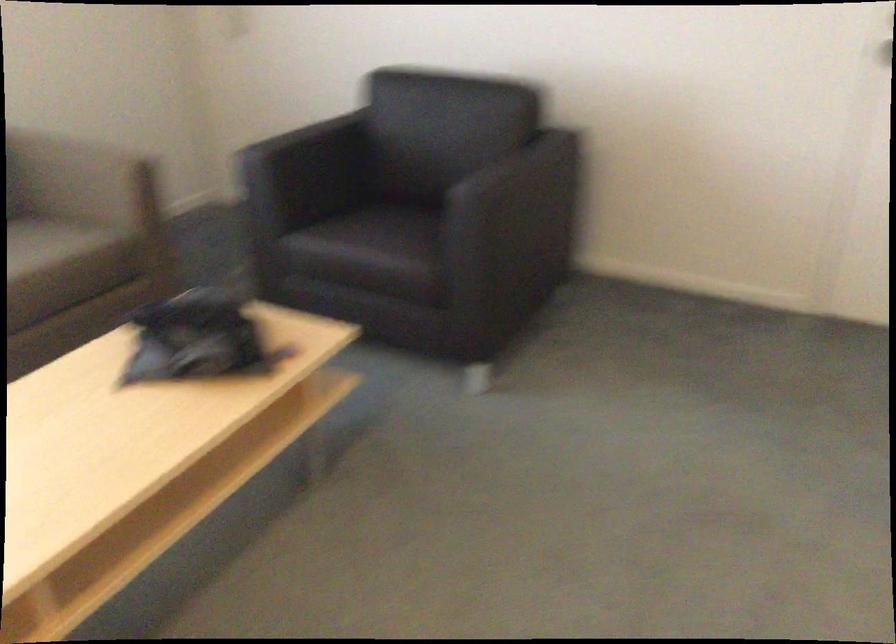
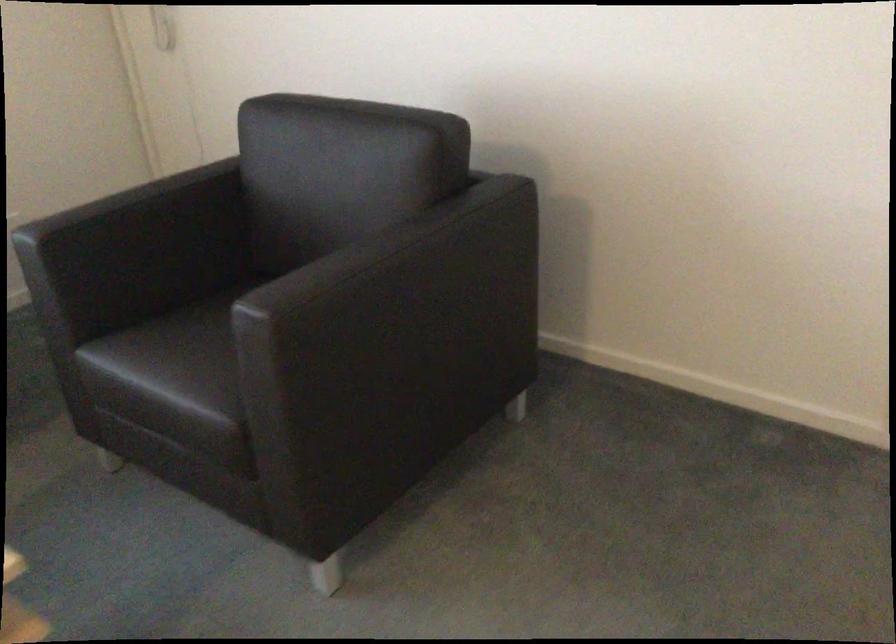
Where in the second image is the point corresponding to pixel 371 240 from the first image?

(168, 366)